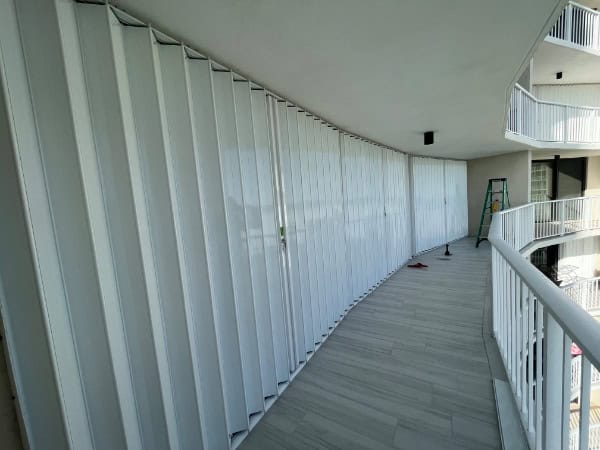
The height and width of the screenshot is (450, 600). What are the coordinates of `glass door` in the screenshot? It's located at (569, 185), (539, 183), (542, 261).